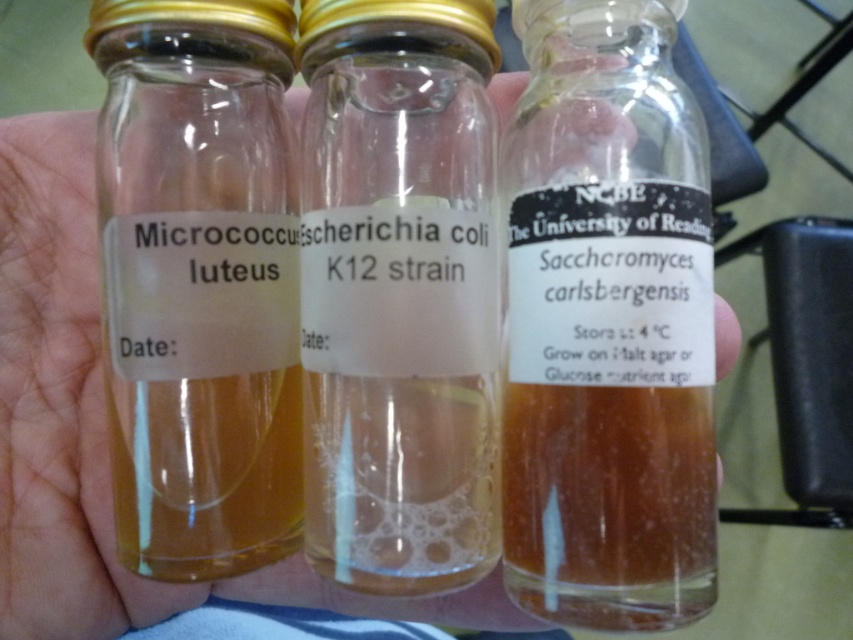
Question: Among these objects, which one is nearest to the camera?

Choices:
 (A) clear glass vials at center
 (B) transparent glass bottle at center

Answer: (B)

Question: Which of these objects is positioned farthest from the translucent glass bottle at left?

Choices:
 (A) clear glass vials at center
 (B) transparent glass bottle at center
 (C) translucent glass vial at center

Answer: (B)

Question: Does translucent glass vial at center have a greater width compared to clear glass vials at center?

Choices:
 (A) yes
 (B) no

Answer: (B)

Question: Can you confirm if translucent glass bottle at left is smaller than clear glass vials at center?

Choices:
 (A) no
 (B) yes

Answer: (B)

Question: Which point appears closest to the camera in this image?

Choices:
 (A) (490, 145)
 (B) (537, 568)
 (C) (33, 400)
 (D) (167, 252)

Answer: (B)

Question: Does transparent glass bottle at center have a larger size compared to clear glass vials at center?

Choices:
 (A) no
 (B) yes

Answer: (A)